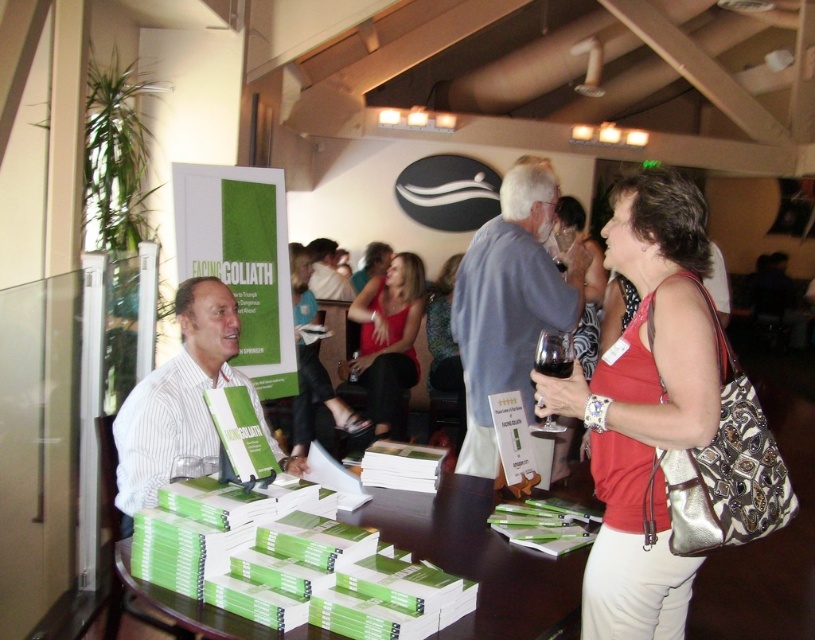
Question: Does red fabric tank top at center appear under matte black dress at center?

Choices:
 (A) no
 (B) yes

Answer: (B)

Question: Which object is farther from the camera taking this photo?

Choices:
 (A) green paper book at center
 (B) matte black dress at center
 (C) matte red tank top at center
 (D) red fabric tank top at center

Answer: (C)

Question: Is red fabric tank top at center below matte black dress at center?

Choices:
 (A) no
 (B) yes

Answer: (B)

Question: Does green paper book at center appear on the left side of matte black dress at center?

Choices:
 (A) no
 (B) yes

Answer: (A)

Question: Which point is closer to the camera taking this photo?

Choices:
 (A) (544, 618)
 (B) (362, 300)

Answer: (A)

Question: Which of these objects is positioned closest to the green paper book at center?

Choices:
 (A) matte red tank top at center
 (B) red fabric tank top at center
 (C) matte black dress at center

Answer: (B)